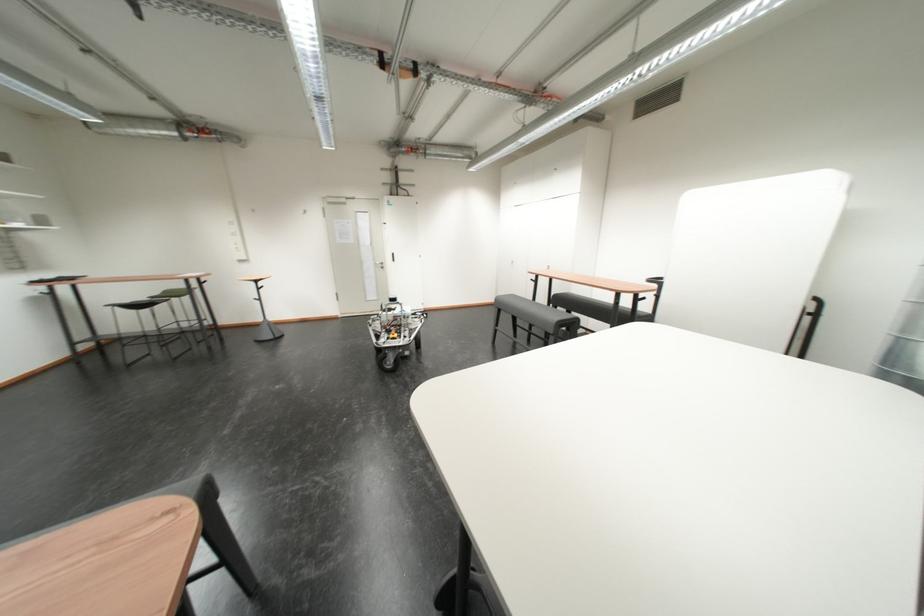
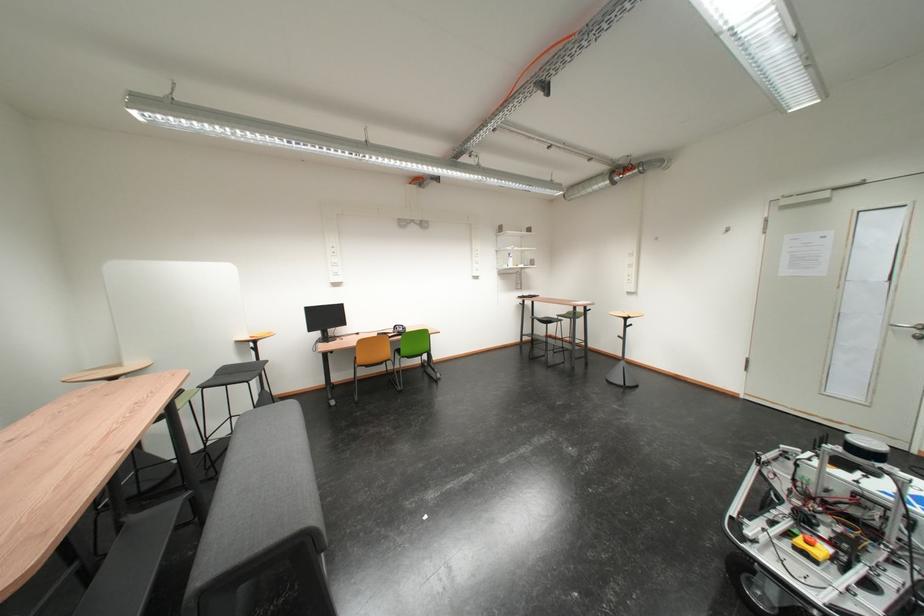
Locate, in the second image, the point that corresponds to (405,337) in the first image.

(820, 545)